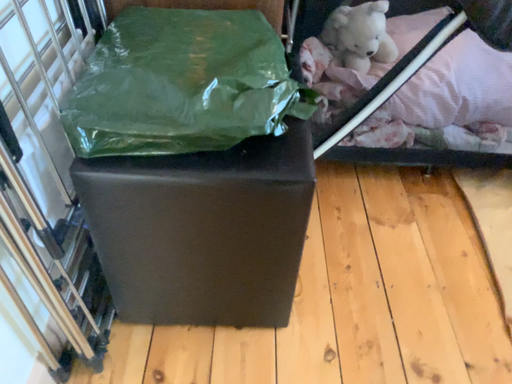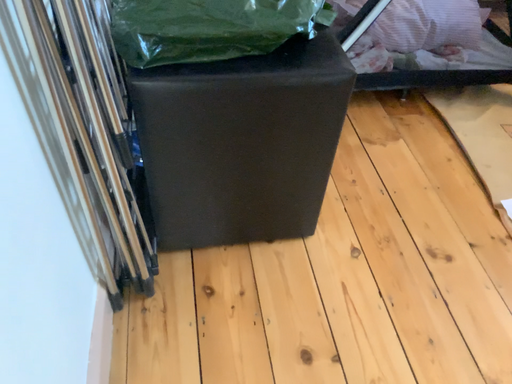
Question: Which way did the camera rotate in the video?

Choices:
 (A) rotated right
 (B) rotated left

Answer: (A)